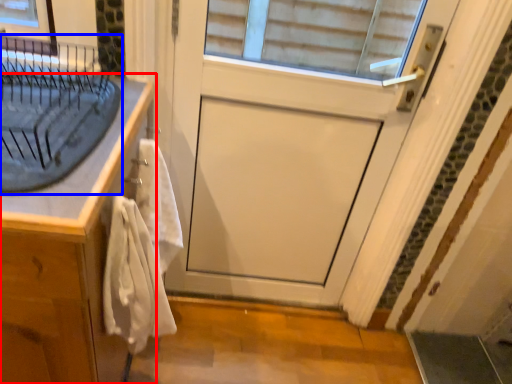
Question: Which object is closer to the camera taking this photo, cabinetry (highlighted by a red box) or sink (highlighted by a blue box)?

Choices:
 (A) cabinetry
 (B) sink

Answer: (B)